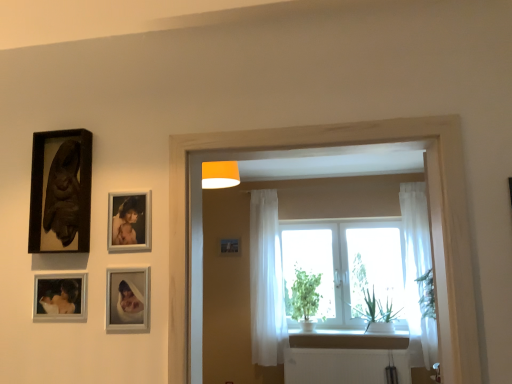
Question: Can you confirm if white sheer curtain at center, placed as the 2th curtain when sorted from right to left, is bigger than matte black picture frame at center?

Choices:
 (A) no
 (B) yes

Answer: (B)

Question: Can you confirm if white sheer curtain at center, placed as the 1th curtain when sorted from left to right, is taller than matte black picture frame at center?

Choices:
 (A) yes
 (B) no

Answer: (A)

Question: From a real-world perspective, does white sheer curtain at center, placed as the 1th curtain when sorted from left to right, stand above matte black picture frame at center?

Choices:
 (A) no
 (B) yes

Answer: (A)

Question: Is white sheer curtain at center, placed as the 1th curtain when sorted from left to right, further to the viewer compared to matte black picture frame at center?

Choices:
 (A) yes
 (B) no

Answer: (B)

Question: From the image's perspective, is white sheer curtain at center, placed as the 2th curtain when sorted from right to left, under matte black picture frame at center?

Choices:
 (A) no
 (B) yes

Answer: (B)

Question: Would you say white plastic radiator at lower center is inside or outside matte black picture frame at center?

Choices:
 (A) outside
 (B) inside

Answer: (A)

Question: Is white plastic radiator at lower center taller or shorter than matte black picture frame at center?

Choices:
 (A) short
 (B) tall

Answer: (B)

Question: In the image, is white plastic radiator at lower center on the left side or the right side of matte black picture frame at center?

Choices:
 (A) right
 (B) left

Answer: (A)

Question: Looking at the image, does white plastic radiator at lower center seem bigger or smaller compared to matte black picture frame at center?

Choices:
 (A) small
 (B) big

Answer: (B)

Question: Considering the positions of green leafy plant at window, the second plant positioned from the left, and matte black picture frame at center in the image, is green leafy plant at window, the second plant positioned from the left, wider or thinner than matte black picture frame at center?

Choices:
 (A) wide
 (B) thin

Answer: (A)

Question: Is point (370, 319) positioned closer to the camera than point (226, 243)?

Choices:
 (A) farther
 (B) closer

Answer: (B)

Question: Considering the positions of green leafy plant at window, which is the 1th plant in right-to-left order, and matte black picture frame at center in the image, is green leafy plant at window, which is the 1th plant in right-to-left order, taller or shorter than matte black picture frame at center?

Choices:
 (A) tall
 (B) short

Answer: (A)

Question: From the image's perspective, is green leafy plant at window, which is the 1th plant in right-to-left order, positioned above or below matte black picture frame at center?

Choices:
 (A) above
 (B) below

Answer: (B)

Question: Considering the positions of white sheer curtain at right, arranged as the first curtain when viewed from the right, and white plastic radiator at lower center in the image, is white sheer curtain at right, arranged as the first curtain when viewed from the right, bigger or smaller than white plastic radiator at lower center?

Choices:
 (A) big
 (B) small

Answer: (A)

Question: Looking at their shapes, would you say white sheer curtain at right, arranged as the first curtain when viewed from the right, is wider or thinner than white plastic radiator at lower center?

Choices:
 (A) wide
 (B) thin

Answer: (A)